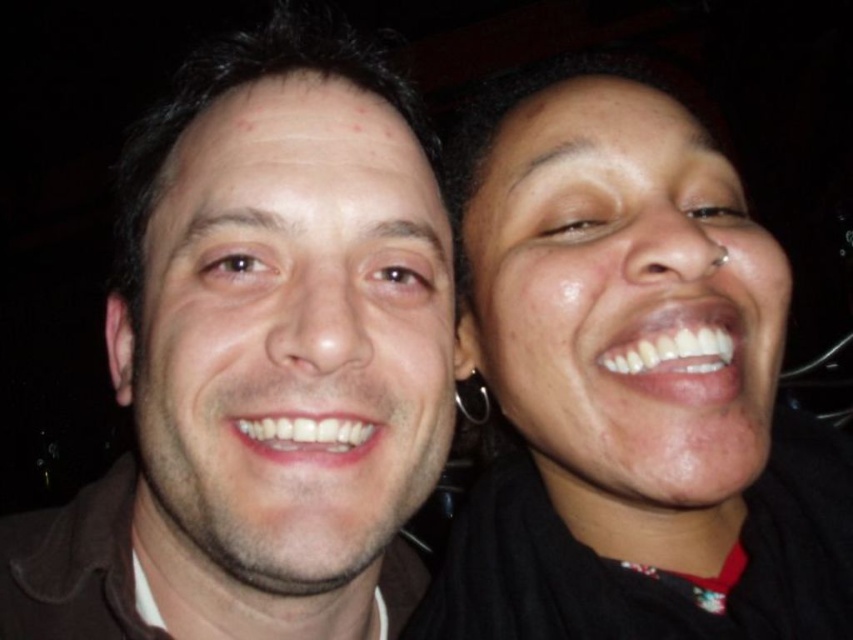
Question: Is smooth skin face at right further to camera compared to silver metallic hoop earring at upper right?

Choices:
 (A) yes
 (B) no

Answer: (B)

Question: Considering the relative positions of matte skin face at left and silver metallic hoop earring at upper right in the image provided, where is matte skin face at left located with respect to silver metallic hoop earring at upper right?

Choices:
 (A) above
 (B) below

Answer: (A)

Question: Which object is positioned farthest from the matte skin face at left?

Choices:
 (A) silver metallic hoop earring at upper right
 (B) smooth skin face at right

Answer: (A)

Question: Based on their relative distances, which object is nearer to the smooth skin face at right?

Choices:
 (A) matte skin face at left
 (B) silver metallic hoop earring at upper right

Answer: (A)

Question: Which is farther from the smooth skin face at right?

Choices:
 (A) silver metallic hoop earring at upper right
 (B) matte skin face at left

Answer: (A)

Question: Can you confirm if smooth skin face at right is wider than silver metallic hoop earring at upper right?

Choices:
 (A) yes
 (B) no

Answer: (A)